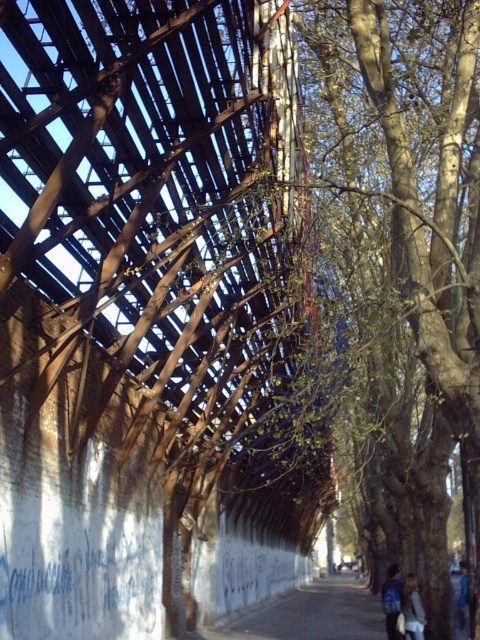
Question: Does blue fabric backpack at center appear over light brown leather jacket at lower right?

Choices:
 (A) no
 (B) yes

Answer: (A)

Question: Among these objects, which one is nearest to the camera?

Choices:
 (A) light brown leather jacket at lower right
 (B) blue fabric backpack at center

Answer: (A)

Question: Is green leafy tree at right below light brown leather jacket at lower right?

Choices:
 (A) no
 (B) yes

Answer: (A)

Question: Which point is closer to the camera?

Choices:
 (A) green leafy tree at right
 (B) light brown leather jacket at lower right
 (C) blue fabric backpack at center

Answer: (A)

Question: Which object is the farthest from the blue fabric backpack at center?

Choices:
 (A) green leafy tree at right
 (B) light brown leather jacket at lower right

Answer: (A)

Question: Does green leafy tree at right have a smaller size compared to light brown leather jacket at lower right?

Choices:
 (A) yes
 (B) no

Answer: (B)